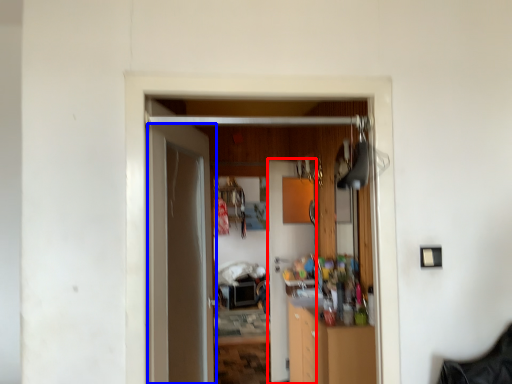
Question: Which object appears farthest to the camera in this image, door (highlighted by a red box) or door (highlighted by a blue box)?

Choices:
 (A) door
 (B) door

Answer: (A)